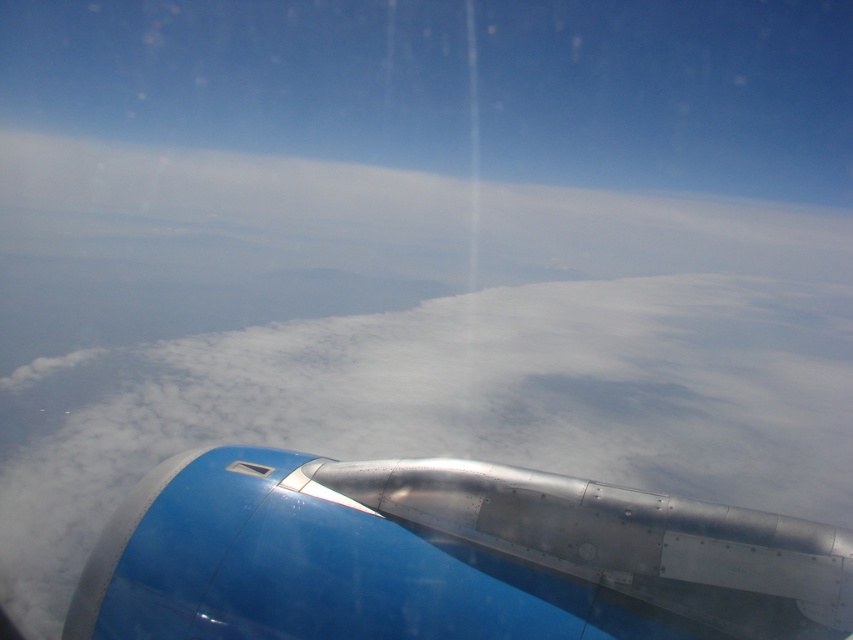
You are a passenger sitting in the airplane seat and looking out the window. You notice the metallic blue engine at lower left and the transparent plastic airplane window at lower left. Which object is closer to you?

The metallic blue engine at lower left is closer to the viewer than the transparent plastic airplane window at lower left.

You are a flight attendant standing in the aisle of the airplane. You want to check if a 6.5 feet long ladder can reach from your current position to the metallic blue engine at lower left. Can you fit the ladder in that space?

The distance between the metallic blue engine at lower left and the viewer is 7.23 feet. Since the ladder is 6.5 feet long, it is shorter than the required distance. Therefore, the ladder cannot reach the metallic blue engine at lower left.